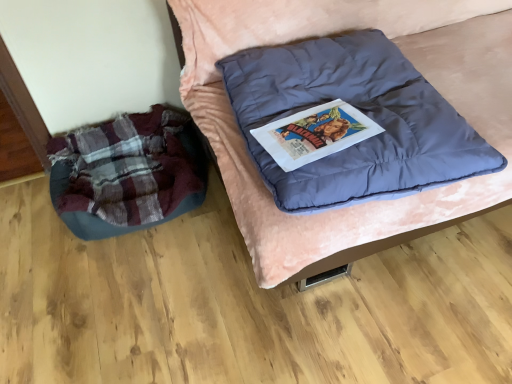
Measure the distance between plaid fabric bean bag at left and camera.

A distance of 1.51 meters exists between plaid fabric bean bag at left and camera.

You are a GUI agent. You are given a task and a screenshot of the screen. Output one action in this format:
    pyautogui.click(x=<x>, y=<y>)
    Task: Click on the plaid fabric bean bag at left
    This screenshot has width=512, height=384.
    Given the screenshot: What is the action you would take?
    pyautogui.click(x=127, y=173)

The image size is (512, 384). What do you see at coordinates (127, 173) in the screenshot?
I see `plaid fabric bean bag at left` at bounding box center [127, 173].

Measure the distance between point (99, 202) and camera.

A distance of 1.56 meters exists between point (99, 202) and camera.

In order to click on matte blue cushion at center in this screenshot , I will do `click(415, 66)`.

The height and width of the screenshot is (384, 512). Describe the element at coordinates (415, 66) in the screenshot. I see `matte blue cushion at center` at that location.

In order to face matte blue cushion at center, should I rotate leftwards or rightwards?

Rotate your view right by about 24.990°.

Where is `plaid fabric bean bag at left`? This screenshot has height=384, width=512. plaid fabric bean bag at left is located at coordinates (127, 173).

Based on their positions, is plaid fabric bean bag at left located to the left or right of matte blue cushion at center?

Based on their positions, plaid fabric bean bag at left is located to the left of matte blue cushion at center.

Relative to matte blue cushion at center, is plaid fabric bean bag at left in front or behind?

plaid fabric bean bag at left is behind matte blue cushion at center.

Considering the points (101, 237) and (385, 24), which point is in front, point (101, 237) or point (385, 24)?

The point (101, 237) is closer to the camera.

From the image's perspective, does plaid fabric bean bag at left appear lower than matte blue cushion at center?

Yes, from the image's perspective, plaid fabric bean bag at left is beneath matte blue cushion at center.

From a real-world perspective, is plaid fabric bean bag at left below matte blue cushion at center?

Yes, from a real-world perspective, plaid fabric bean bag at left is beneath matte blue cushion at center.

Between plaid fabric bean bag at left and matte blue cushion at center, which one has smaller width?

plaid fabric bean bag at left is thinner.

Considering the relative sizes of plaid fabric bean bag at left and matte blue cushion at center in the image provided, is plaid fabric bean bag at left shorter than matte blue cushion at center?

Indeed, plaid fabric bean bag at left has a lesser height compared to matte blue cushion at center.

Between plaid fabric bean bag at left and matte blue cushion at center, which one has smaller size?

plaid fabric bean bag at left.

Would you say plaid fabric bean bag at left is inside or outside matte blue cushion at center?

plaid fabric bean bag at left is not enclosed by matte blue cushion at center.

Is plaid fabric bean bag at left beside matte blue cushion at center?

plaid fabric bean bag at left and matte blue cushion at center are not in contact.

Is matte blue cushion at center at the back of plaid fabric bean bag at left?

No, plaid fabric bean bag at left is not facing the opposite direction of matte blue cushion at center.

How many degrees apart are the facing directions of plaid fabric bean bag at left and matte blue cushion at center?

The facing directions of plaid fabric bean bag at left and matte blue cushion at center are 2.15e-05 degrees apart.

Where is `furniture on the right of plaid fabric bean bag at left`? The height and width of the screenshot is (384, 512). furniture on the right of plaid fabric bean bag at left is located at coordinates (415, 66).

Which object is positioned more to the left, matte blue cushion at center or plaid fabric bean bag at left?

plaid fabric bean bag at left is more to the left.

In the image, is matte blue cushion at center positioned in front of or behind plaid fabric bean bag at left?

matte blue cushion at center is positioned closer to the viewer than plaid fabric bean bag at left.

Which is behind, point (262, 11) or point (176, 154)?

Positioned behind is point (176, 154).

From the image's perspective, which one is positioned higher, matte blue cushion at center or plaid fabric bean bag at left?

matte blue cushion at center is shown above in the image.

From a real-world perspective, relative to plaid fabric bean bag at left, is matte blue cushion at center vertically above or below?

In terms of real-world spatial position, matte blue cushion at center is above plaid fabric bean bag at left.

Looking at their sizes, would you say matte blue cushion at center is wider or thinner than plaid fabric bean bag at left?

In the image, matte blue cushion at center appears to be wider than plaid fabric bean bag at left.

Considering the sizes of objects matte blue cushion at center and plaid fabric bean bag at left in the image provided, who is shorter, matte blue cushion at center or plaid fabric bean bag at left?

With less height is plaid fabric bean bag at left.

In terms of size, does matte blue cushion at center appear bigger or smaller than plaid fabric bean bag at left?

Considering their sizes, matte blue cushion at center takes up more space than plaid fabric bean bag at left.

Is plaid fabric bean bag at left located within matte blue cushion at center?

No, matte blue cushion at center does not contain plaid fabric bean bag at left.

Is there a large distance between matte blue cushion at center and plaid fabric bean bag at left?

matte blue cushion at center is actually quite close to plaid fabric bean bag at left.

Is matte blue cushion at center facing away from plaid fabric bean bag at left?

No, matte blue cushion at center's orientation is not away from plaid fabric bean bag at left.

How many degrees apart are the facing directions of matte blue cushion at center and plaid fabric bean bag at left?

They differ by 2.15e-05 degrees in their facing directions.

Looking at this image, how far apart are matte blue cushion at center and plaid fabric bean bag at left?

The distance of matte blue cushion at center from plaid fabric bean bag at left is 20.42 inches.

Locate an element on the screen. This screenshot has height=384, width=512. furniture positioned vertically above the plaid fabric bean bag at left (from a real-world perspective) is located at coordinates (415, 66).

Locate an element on the screen. The height and width of the screenshot is (384, 512). bean bag chair that appears behind the matte blue cushion at center is located at coordinates (127, 173).

In order to click on furniture located above the plaid fabric bean bag at left (from the image's perspective) in this screenshot , I will do tap(415, 66).